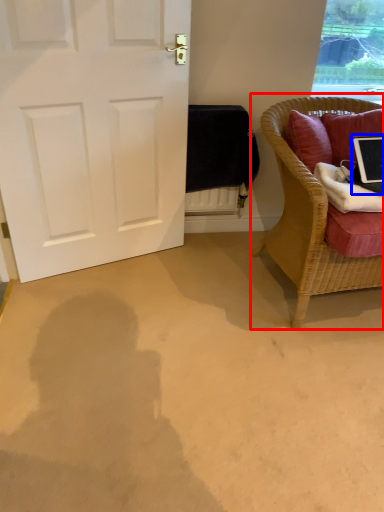
Question: Which object is further to the camera taking this photo, chair (highlighted by a red box) or laptop (highlighted by a blue box)?

Choices:
 (A) chair
 (B) laptop

Answer: (B)